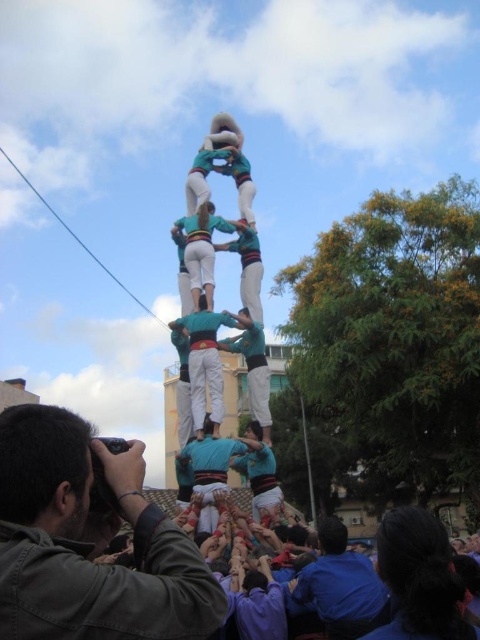
Question: Which is nearer to the dark green fabric camera at lower left?

Choices:
 (A) blue cotton shirt at lower right
 (B) blue fabric human at center

Answer: (A)

Question: Does dark green fabric camera at lower left appear on the left side of blue cotton shirt at lower right?

Choices:
 (A) no
 (B) yes

Answer: (B)

Question: From the image, what is the correct spatial relationship of dark green fabric camera at lower left in relation to blue cotton shirt at lower right?

Choices:
 (A) below
 (B) above

Answer: (B)

Question: Does dark green fabric camera at lower left lie behind blue cotton shirt at lower right?

Choices:
 (A) yes
 (B) no

Answer: (B)

Question: Which object appears closest to the camera in this image?

Choices:
 (A) dark green fabric camera at lower left
 (B) blue cotton shirt at lower right

Answer: (A)

Question: Which of the following is the closest to the observer?

Choices:
 (A) (200, 624)
 (B) (365, 564)
 (C) (206, 509)

Answer: (A)